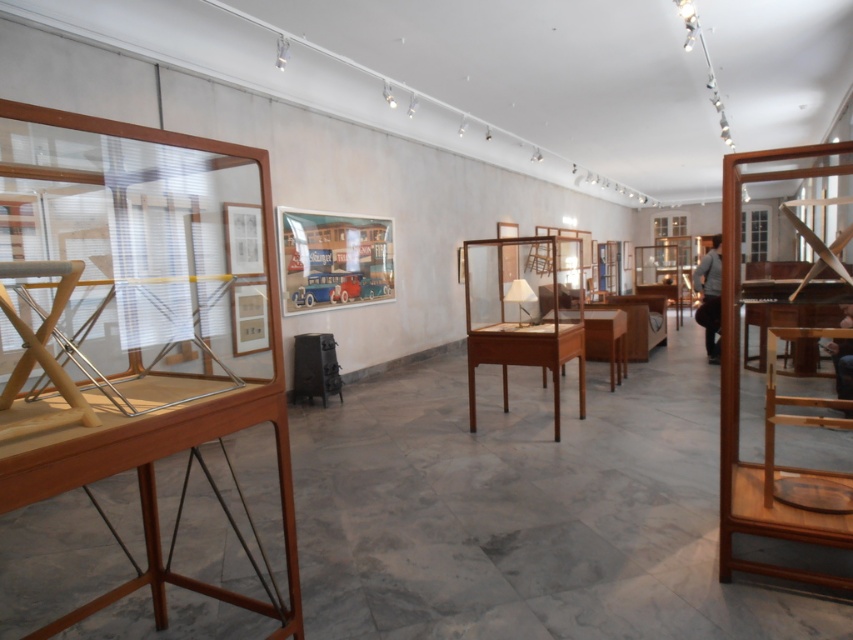
Question: Can you confirm if teak wood folding chair at right is smaller than teak wood cabinet at center?

Choices:
 (A) no
 (B) yes

Answer: (A)

Question: Is teak wood folding chair at right closer to camera compared to teak wood cabinet at center?

Choices:
 (A) yes
 (B) no

Answer: (A)

Question: Which point is farther to the camera?

Choices:
 (A) teak wood cabinet at center
 (B) teak wood folding chair at right

Answer: (A)

Question: Which point is farther to the camera?

Choices:
 (A) teak wood folding chair at right
 (B) teak wood cabinet at center

Answer: (B)

Question: Is teak wood folding chair at right wider than teak wood cabinet at center?

Choices:
 (A) no
 (B) yes

Answer: (B)